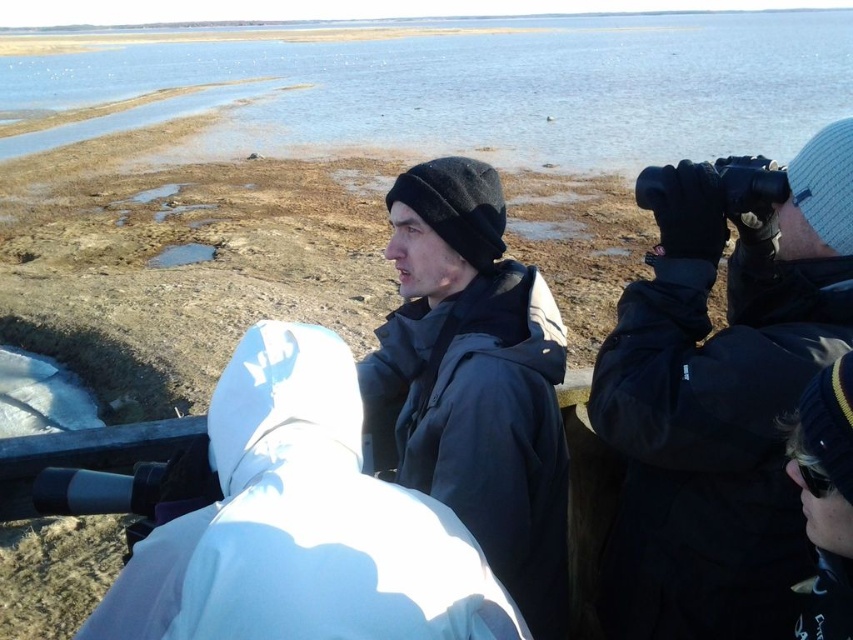
Question: Which object is the farthest from the knitted wool hat at lower right?

Choices:
 (A) black matte binoculars at upper right
 (B) dark gray knit cap at center

Answer: (B)

Question: Based on their relative distances, which object is nearer to the knitted wool hat at lower right?

Choices:
 (A) blue water at center
 (B) black matte binoculars at upper right

Answer: (B)

Question: Does blue water at center appear over black matte binoculars at upper right?

Choices:
 (A) no
 (B) yes

Answer: (B)

Question: Can you confirm if blue water at center is positioned below dark gray knit cap at center?

Choices:
 (A) no
 (B) yes

Answer: (A)

Question: Which object appears closest to the camera in this image?

Choices:
 (A) knitted wool hat at lower right
 (B) black matte binoculars at upper right

Answer: (A)

Question: Is dark gray knit cap at center further to the viewer compared to knitted wool hat at lower right?

Choices:
 (A) no
 (B) yes

Answer: (B)